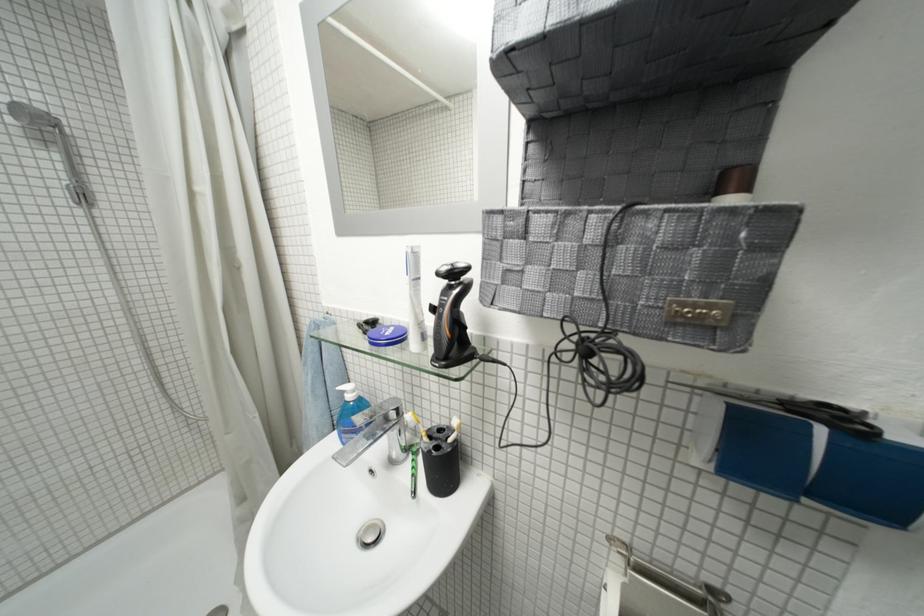
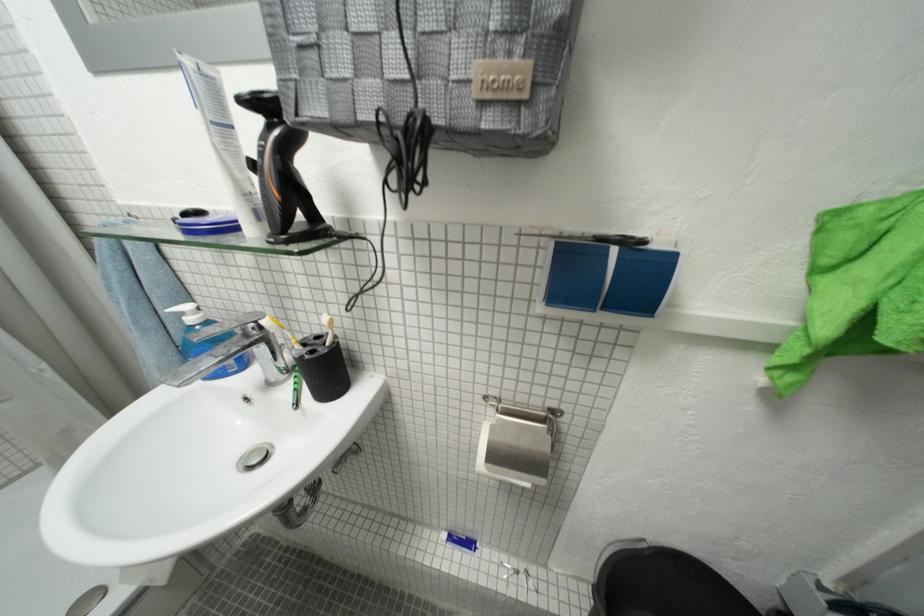
Locate, in the second image, the point that corresponds to (x=455, y=301) in the first image.

(273, 147)